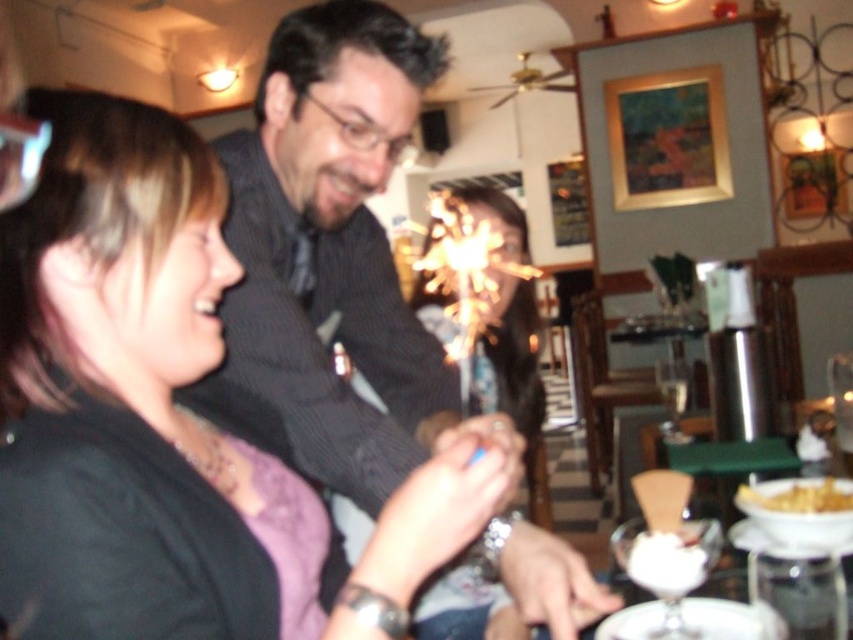
You are a photographer at the event and want to capture a photo that includes both the shiny black shirt at center and the white creamy dessert at lower center. Based on their positions, which object should you ensure is placed on the left side of the frame to include both in the shot?

The shiny black shirt at center is positioned on the left side of the white creamy dessert at lower center, so you should place the shiny black shirt at center on the left side of the frame to include both in the shot.